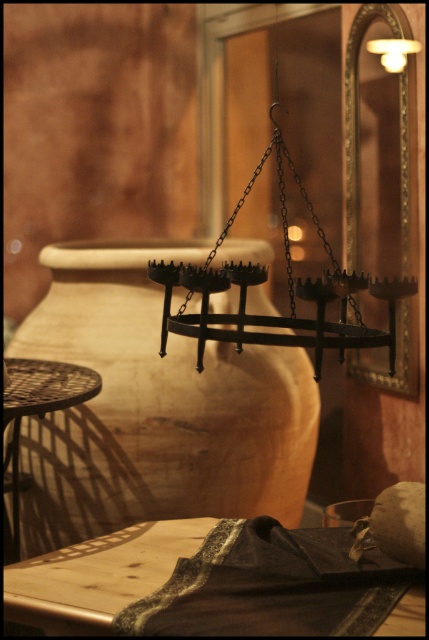
You are an interior designer assessing the space. You need to determine if the wooden table at lower left can fit under the matte black chandelier at upper center without any obstruction. Based on their sizes, can the table fit comfortably underneath the chandelier?

The matte black chandelier at upper center is larger in size than the wooden table at lower left, so the table can fit comfortably underneath the chandelier without any obstruction.

You are a customer entering the rustic interior and want to place a large plate of food on the wooden table at lower left and the matte white light fixture at upper right. Which surface can accommodate the plate based on their sizes?

The wooden table at lower left has a larger width than the matte white light fixture at upper right, so the wooden table at lower left can accommodate the large plate of food.